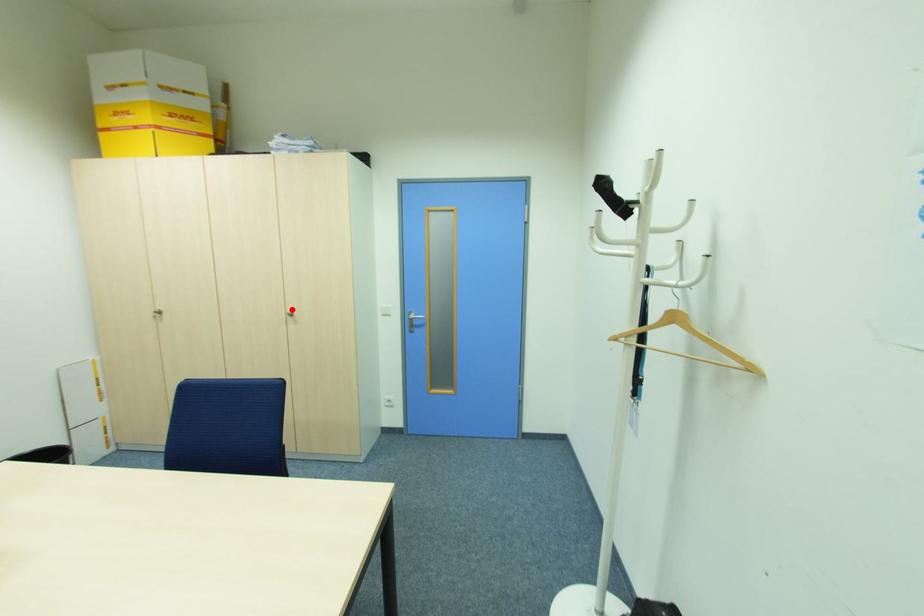
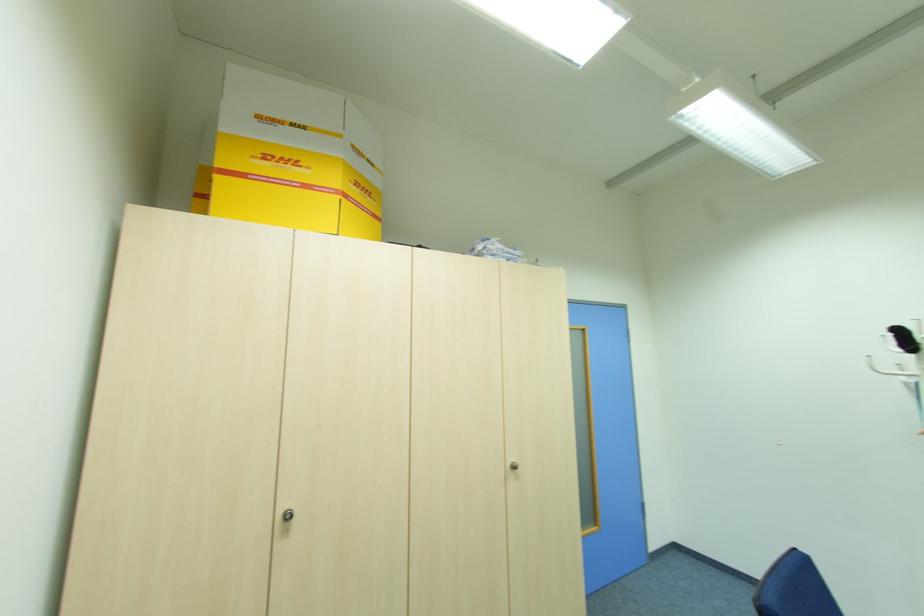
Find the pixel in the second image that matches the highlighted location in the first image.

(513, 460)